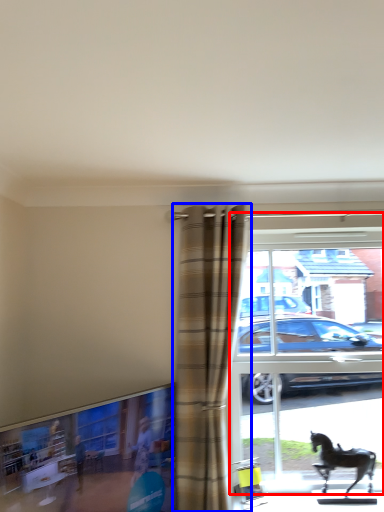
Question: Which object appears closest to the camera in this image, window (highlighted by a red box) or curtain (highlighted by a blue box)?

Choices:
 (A) window
 (B) curtain

Answer: (B)